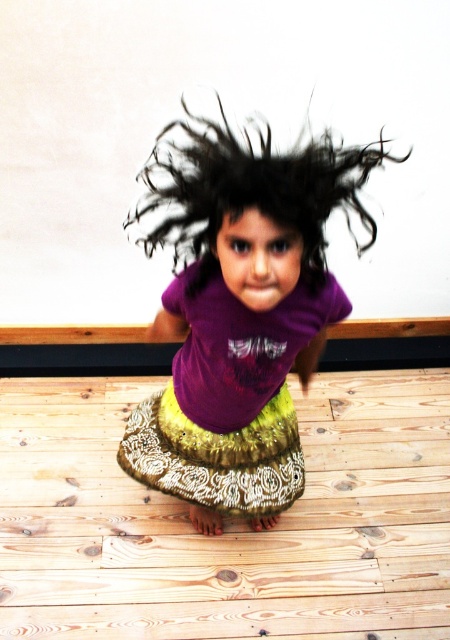
From the picture: Measure the distance between purple matte shirt at center and black curly hair at center.

The distance of purple matte shirt at center from black curly hair at center is 17.20 centimeters.

Where is `purple matte shirt at center`? This screenshot has height=640, width=450. purple matte shirt at center is located at coordinates (242, 316).

This screenshot has width=450, height=640. What do you see at coordinates (242, 316) in the screenshot?
I see `purple matte shirt at center` at bounding box center [242, 316].

Between purple matte shirt at center and gold sequined skirt at center, which one is positioned higher?

purple matte shirt at center

This screenshot has width=450, height=640. What do you see at coordinates (242, 316) in the screenshot?
I see `purple matte shirt at center` at bounding box center [242, 316].

Locate an element on the screen. Image resolution: width=450 pixels, height=640 pixels. purple matte shirt at center is located at coordinates (242, 316).

Can you confirm if gold sequined skirt at center is taller than black curly hair at center?

Indeed, gold sequined skirt at center has a greater height compared to black curly hair at center.

Which is more to the right, gold sequined skirt at center or black curly hair at center?

From the viewer's perspective, black curly hair at center appears more on the right side.

Who is more distant from viewer, (268, 506) or (246, 182)?

Point (268, 506)

Where is `gold sequined skirt at center`? Image resolution: width=450 pixels, height=640 pixels. gold sequined skirt at center is located at coordinates (229, 400).